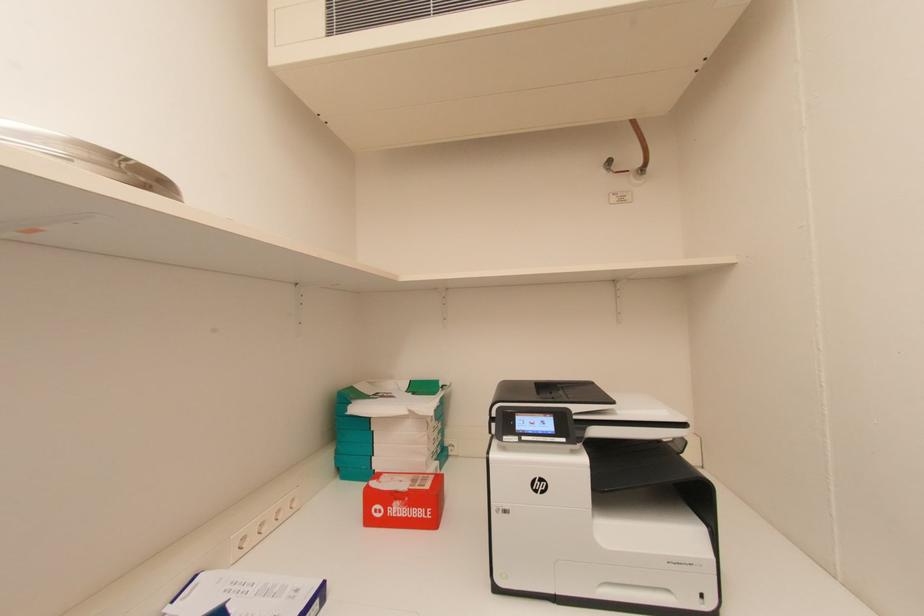
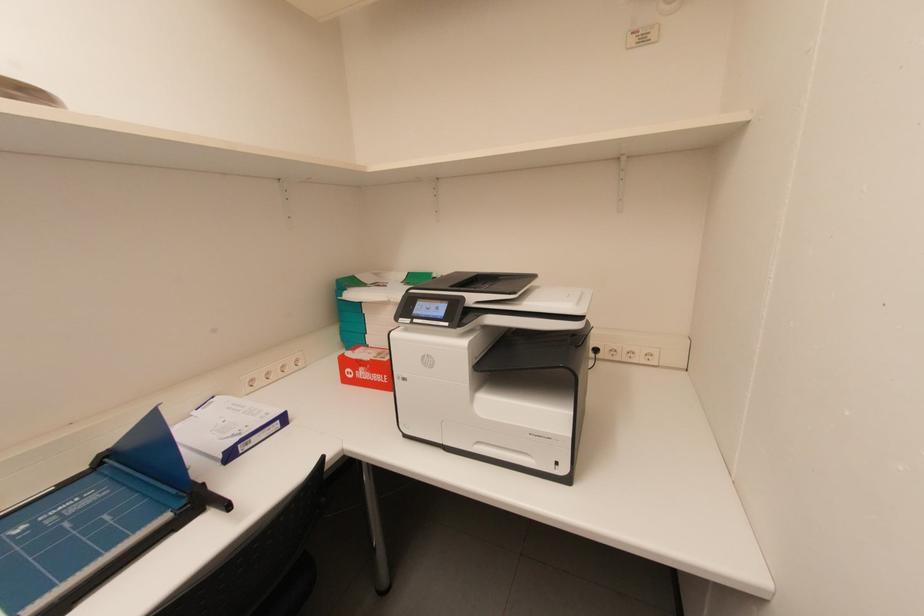
Question: The images are taken continuously from a first-person perspective. In which direction is your viewpoint rotating?

Choices:
 (A) Left
 (B) Right
 (C) Up
 (D) Down

Answer: (D)